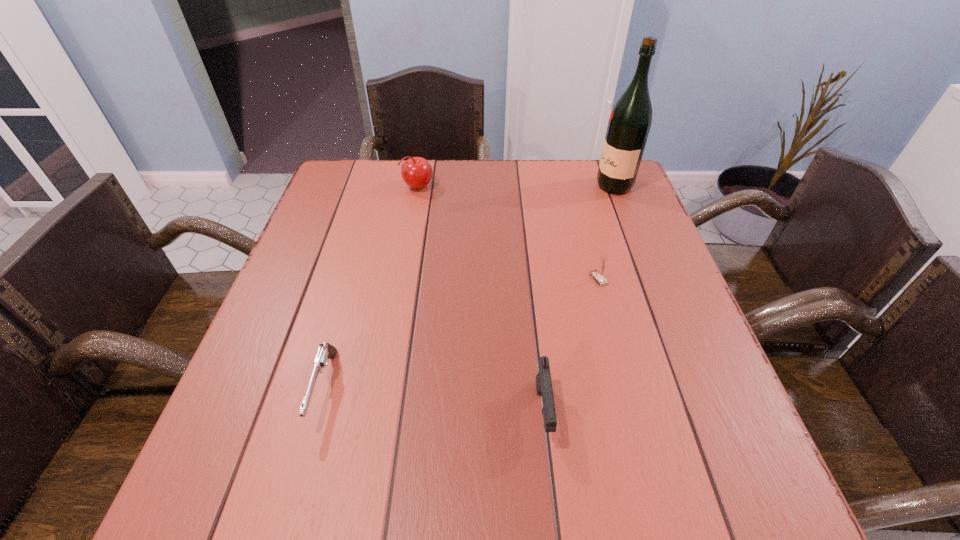
Locate an element on the screen. This screenshot has width=960, height=540. empty space between the liquor and the taller pistol is located at coordinates (579, 299).

I want to click on free space between the matchbox and the taller pistol, so click(x=571, y=346).

Where is `free space between the left pistol and the liquor`? free space between the left pistol and the liquor is located at coordinates (469, 287).

What are the coordinates of `empty location between the leftmost object and the tallest object` in the screenshot? It's located at 469,287.

The width and height of the screenshot is (960, 540). In order to click on vacant area that lies between the rightmost object and the taller pistol in this screenshot , I will do `click(579, 299)`.

Locate an element on the screen. vacant point located between the leftmost object and the rightmost object is located at coordinates (469, 287).

Find the location of a particular element. free space between the third farthest object and the right pistol is located at coordinates (571, 346).

Where is `free space between the left pistol and the tallest object`? This screenshot has height=540, width=960. free space between the left pistol and the tallest object is located at coordinates (469, 287).

Select which object is the second closest to the rightmost object. Please provide its 2D coordinates. Your answer should be formatted as a tuple, i.e. [(x, y)], where the tuple contains the x and y coordinates of a point satisfying the conditions above.

[(416, 172)]

Identify the location of the third closest object to the shortest object. Image resolution: width=960 pixels, height=540 pixels. (599, 276).